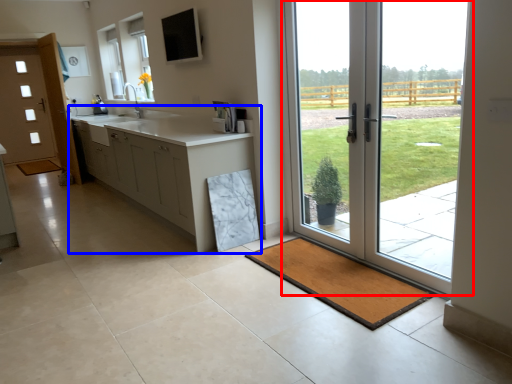
Question: Which point is further to the camera, door (highlighted by a red box) or cabinetry (highlighted by a blue box)?

Choices:
 (A) door
 (B) cabinetry

Answer: (B)